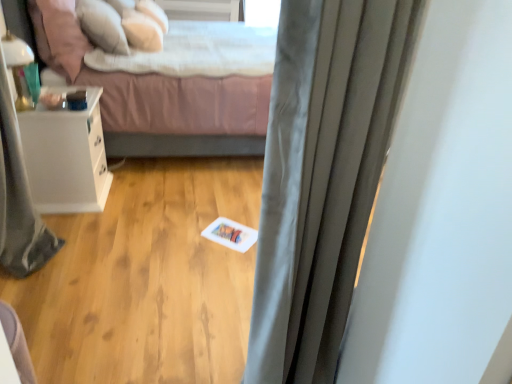
In order to click on free area in between gray fabric shower curtain at left and white glossy nightstand at left in this screenshot , I will do `click(72, 228)`.